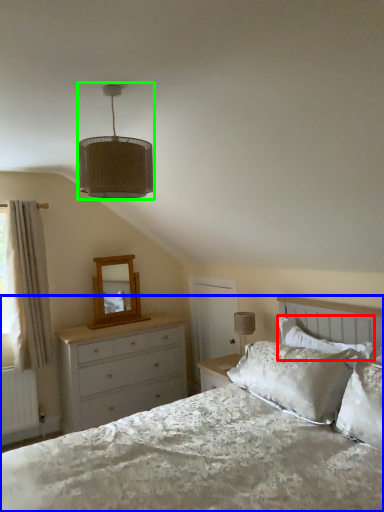
Question: Estimate the real-world distances between objects in this image. Which object is closer to pillow (highlighted by a red box), bed (highlighted by a blue box) or lamp (highlighted by a green box)?

Choices:
 (A) bed
 (B) lamp

Answer: (A)